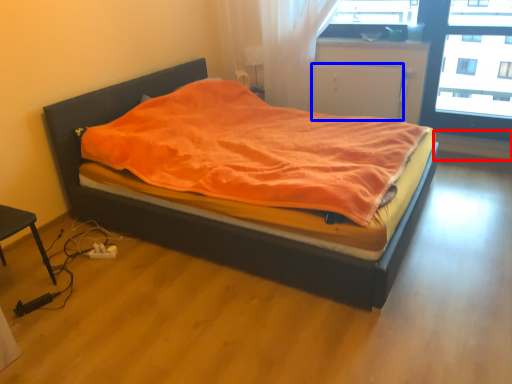
Question: Which object is closer to the camera taking this photo, window sill (highlighted by a red box) or screen door (highlighted by a blue box)?

Choices:
 (A) window sill
 (B) screen door

Answer: (B)